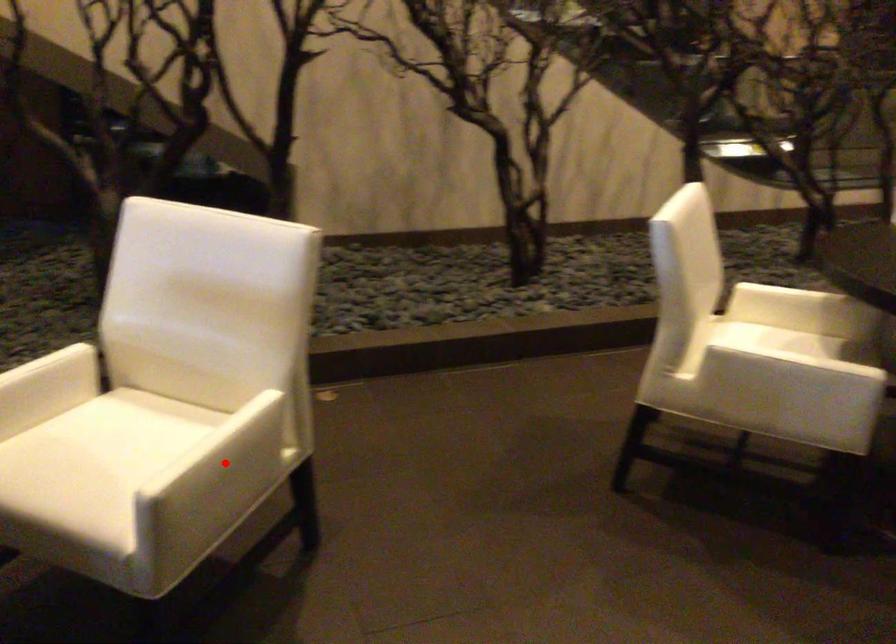
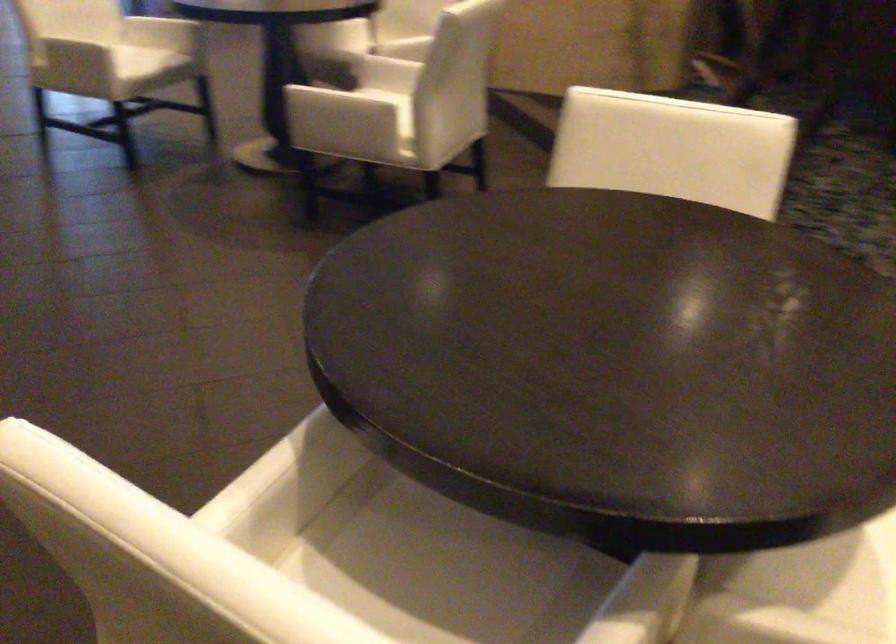
Question: I am providing you with two images of the same scene from different viewpoints. A red point is marked on the first image. Is the red point's position out of view in image 2?

Choices:
 (A) Yes
 (B) No

Answer: (A)